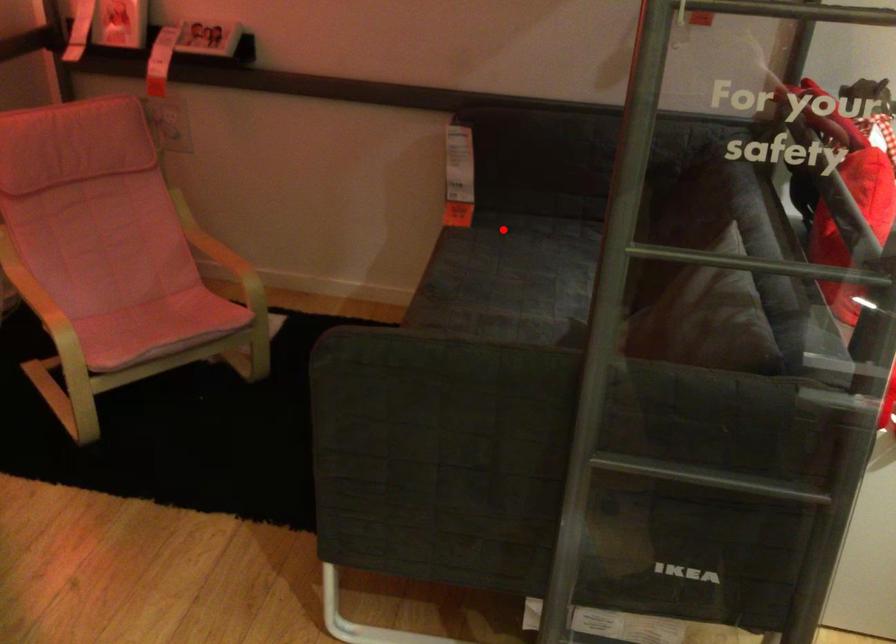
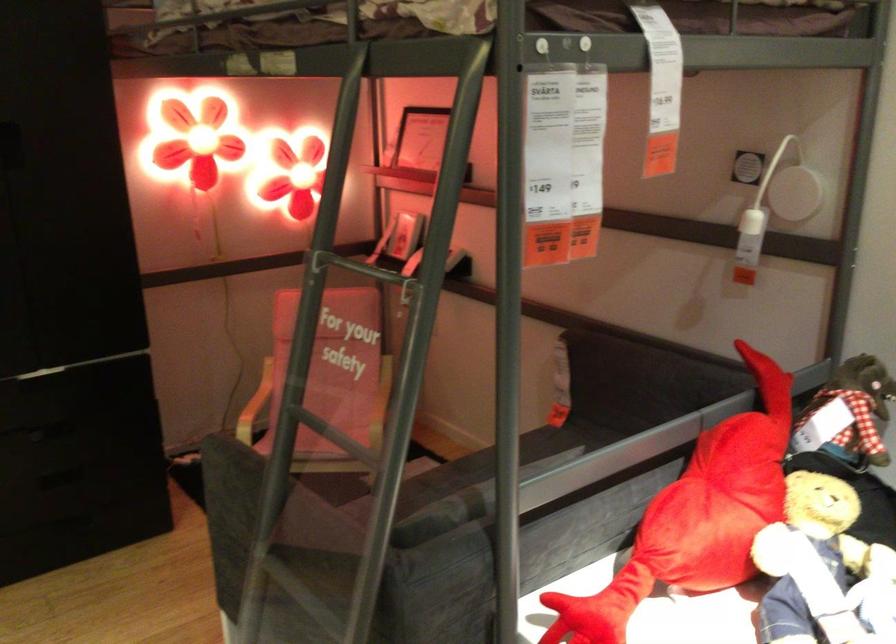
Question: I am providing you with two images of the same scene from different viewpoints. In image1, a red point is highlighted. Considering the same 3D point in image2, which of the following is correct?

Choices:
 (A) It is closer
 (B) It is farther

Answer: (B)